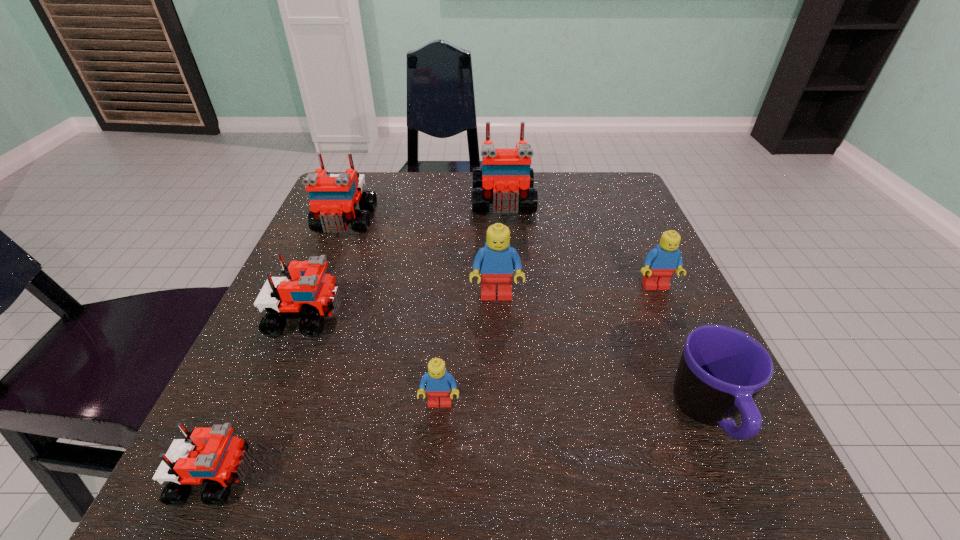
Image resolution: width=960 pixels, height=540 pixels. I want to click on Lego present at the near edge, so click(212, 455).

The width and height of the screenshot is (960, 540). Find the location of `Lego present at the right edge`. Lego present at the right edge is located at coordinates (661, 262).

Where is `mug present at the right edge`? The image size is (960, 540). mug present at the right edge is located at coordinates (721, 370).

Identify the location of object that is at the far left corner. (334, 197).

Where is `object at the near left corner`? The height and width of the screenshot is (540, 960). object at the near left corner is located at coordinates (212, 455).

Where is `object at the near right corner`? The height and width of the screenshot is (540, 960). object at the near right corner is located at coordinates (721, 370).

I want to click on vacant area at the far edge, so click(546, 185).

This screenshot has height=540, width=960. In the image, there is a desktop. What are the coordinates of `vacant space at the left edge` in the screenshot? It's located at (371, 283).

Where is `blank space at the right edge of the desktop`? The image size is (960, 540). blank space at the right edge of the desktop is located at coordinates (682, 327).

You are a GUI agent. You are given a task and a screenshot of the screen. Output one action in this format:
    pyautogui.click(x=<x>, y=<y>)
    Task: Click on the free region at the far left corner of the desktop
    The height and width of the screenshot is (540, 960).
    Given the screenshot: What is the action you would take?
    pyautogui.click(x=389, y=195)